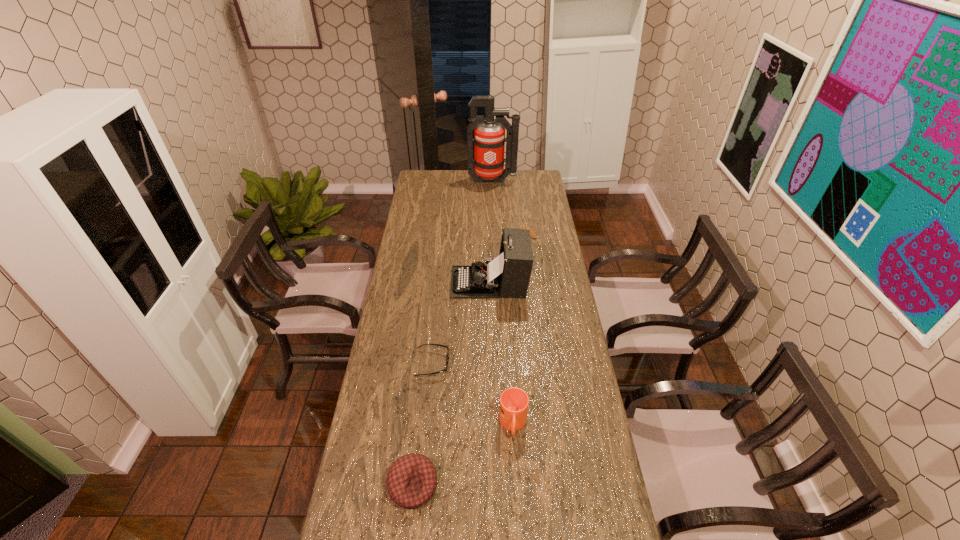
The width and height of the screenshot is (960, 540). Find the location of `free area in between the second nearest object and the fifth shortest object`. free area in between the second nearest object and the fifth shortest object is located at coordinates (501, 353).

Where is `vacant region between the typewriter and the fourth tallest object`? vacant region between the typewriter and the fourth tallest object is located at coordinates (451, 384).

This screenshot has width=960, height=540. What are the coordinates of `vacant region between the third shortest object and the second nearest object` in the screenshot? It's located at (463, 455).

The image size is (960, 540). I want to click on vacant space in between the mug and the beanbag, so click(463, 455).

Where is `vacant area that lies between the farthest object and the mug`? The image size is (960, 540). vacant area that lies between the farthest object and the mug is located at coordinates (503, 302).

This screenshot has height=540, width=960. Find the location of `free space that is in between the farthest object and the fifth farthest object`. free space that is in between the farthest object and the fifth farthest object is located at coordinates (503, 302).

In order to click on free space between the fifth shortest object and the fifth farthest object in this screenshot , I will do click(501, 353).

Point out which object is positioned as the fourth nearest to the fifth tallest object. Please provide its 2D coordinates. Your answer should be formatted as a tuple, i.e. [(x, y)], where the tuple contains the x and y coordinates of a point satisfying the conditions above.

[(514, 402)]

Locate which object is the second closest to the tallest object. Please provide its 2D coordinates. Your answer should be formatted as a tuple, i.e. [(x, y)], where the tuple contains the x and y coordinates of a point satisfying the conditions above.

[(508, 275)]

Find the location of a particular element. free space that satisfies the following two spatial constraints: 1. on the front label side of the tallest object; 2. on the left side of the second farthest object is located at coordinates (494, 235).